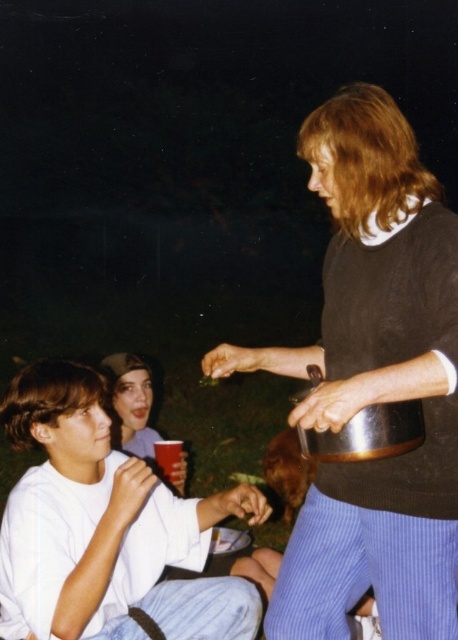
You are trying to place a new item between the matte black sweater at center and the smooth plastic cup at lower left. Based on their sizes, will there be enough space for the item?

The matte black sweater at center might be wider than the smooth plastic cup at lower left, so there may not be enough space between them for the new item.

You are at a nighttime gathering and see the matte black sweater at center and the smooth plastic cup at lower left. Which object is closer to you?

The matte black sweater at center is closer to you because it is in front of the smooth plastic cup at lower left.